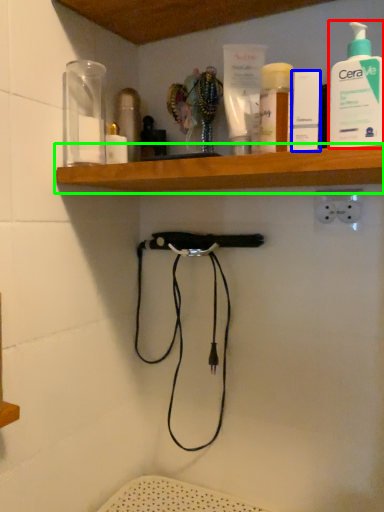
Question: Considering the real-world distances, which object is closest to cleaning product (highlighted by a red box)? toiletry (highlighted by a blue box) or shelf (highlighted by a green box).

Choices:
 (A) toiletry
 (B) shelf

Answer: (A)